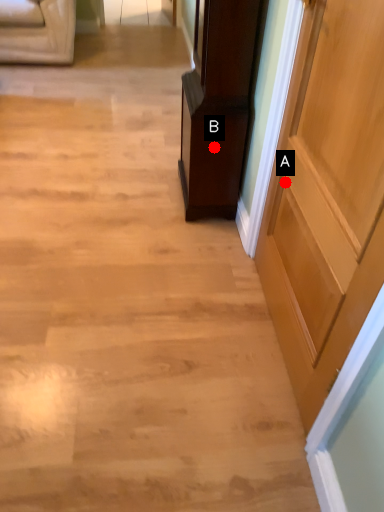
Question: Two points are circled on the image, labeled by A and B beside each circle. Which point appears farthest from the camera in this image?

Choices:
 (A) A is further
 (B) B is further

Answer: (B)